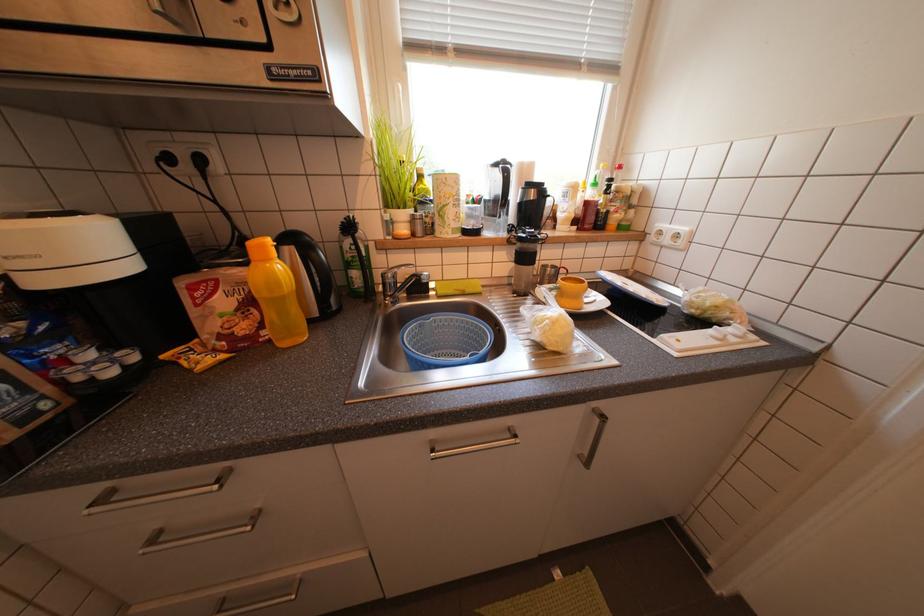
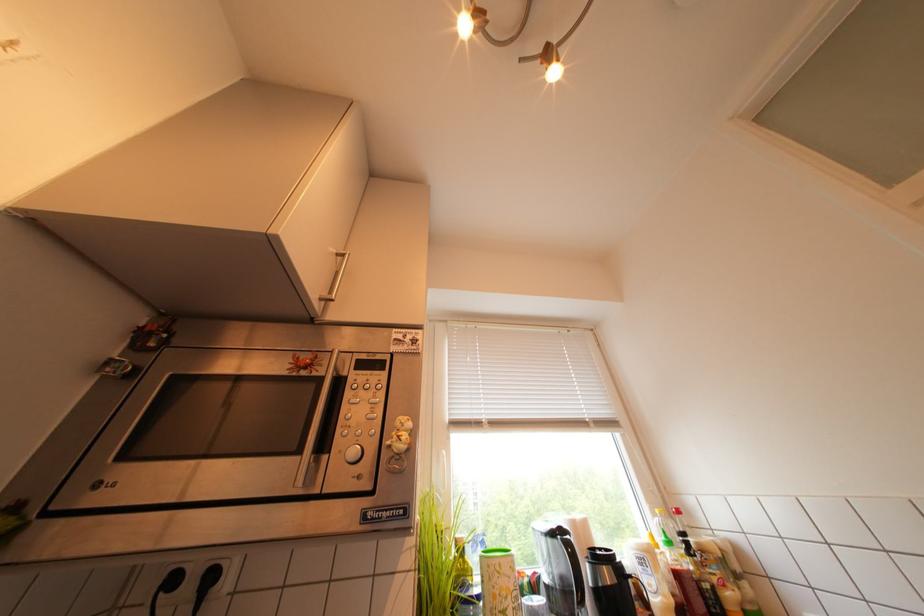
Question: The first image is from the beginning of the video and the second image is from the end. How did the camera likely rotate when shooting the video?

Choices:
 (A) Left
 (B) Right
 (C) Up
 (D) Down

Answer: (C)